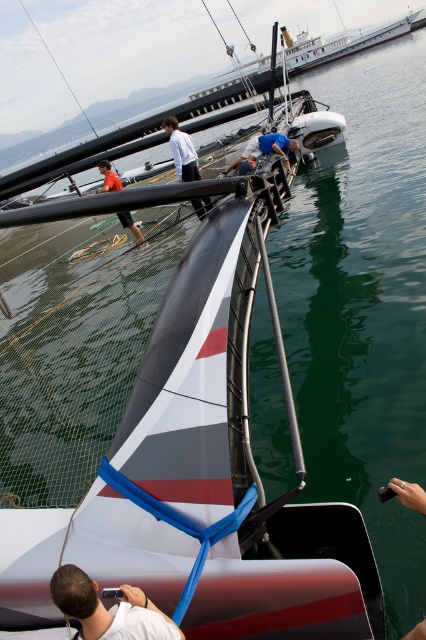
You are standing at the center of the marina and want to take a photo of the sailboat. The white matte camera at lower left is your only camera available. Can you use it to take a photo of the sailboat from your current position?

Yes, since the white matte camera at lower left is located at point (108,611), which is within the marina area, you can use it to take a photo of the sailboat from your current position at the center.